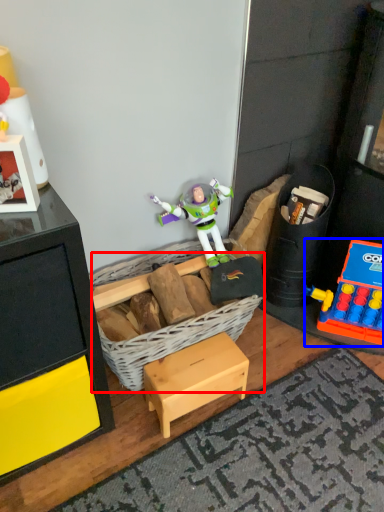
Question: Among these objects, which one is nearest to the camera, basket (highlighted by a red box) or toy (highlighted by a blue box)?

Choices:
 (A) basket
 (B) toy

Answer: (A)